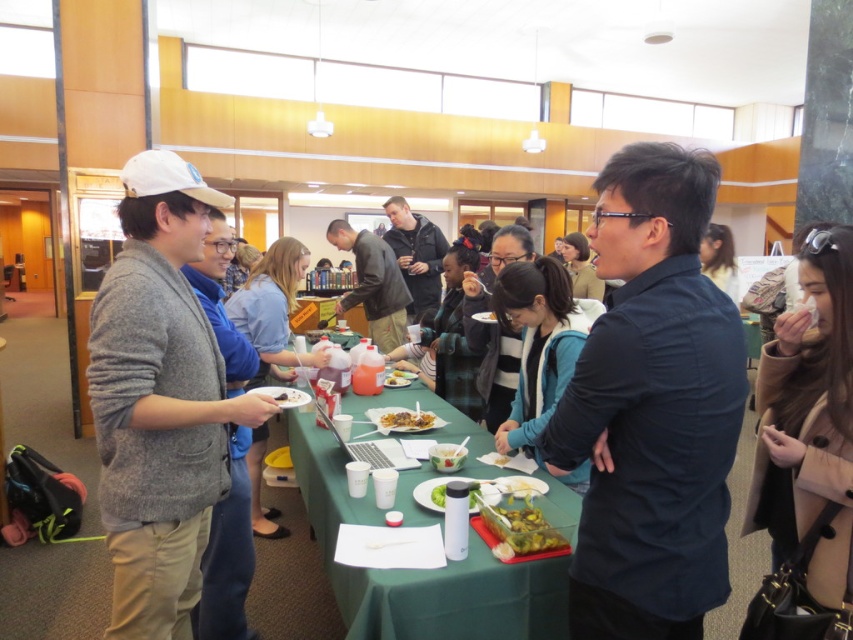
Question: Is matte gray sweater at center to the right of leather jacket at center from the viewer's perspective?

Choices:
 (A) no
 (B) yes

Answer: (A)

Question: Does clear plastic container at center have a greater width compared to white matte plate at center?

Choices:
 (A) yes
 (B) no

Answer: (A)

Question: Which point is farther to the camera?

Choices:
 (A) (334, 509)
 (B) (404, 385)
 (C) (190, 465)
 (D) (294, 397)

Answer: (B)

Question: Among these objects, which one is nearest to the camera?

Choices:
 (A) gray wool sweater at left
 (B) yellow matte food at center
 (C) clear plastic container at center
 (D) matte gray sweater at center

Answer: (A)

Question: Is green fabric table at center bigger than white matte bowl at center?

Choices:
 (A) yes
 (B) no

Answer: (A)

Question: Based on their relative distances, which object is nearer to the matte gray sweater at center?

Choices:
 (A) gray sweater at left
 (B) green fabric table at center

Answer: (A)